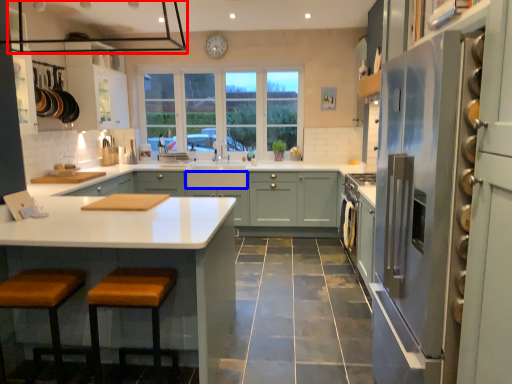
Question: Among these objects, which one is farthest to the camera, exhaust hood (highlighted by a red box) or drawer (highlighted by a blue box)?

Choices:
 (A) exhaust hood
 (B) drawer

Answer: (B)